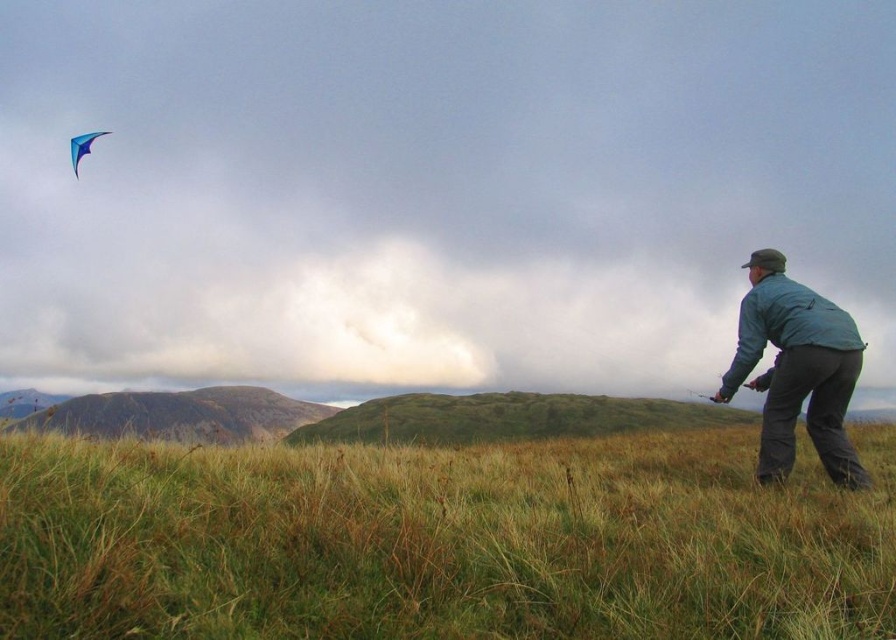
Question: Which is nearer to the green grassy field at lower right?

Choices:
 (A) green matte jacket at right
 (B) blue glossy kite at upper left

Answer: (A)

Question: Does green matte jacket at right come behind blue glossy kite at upper left?

Choices:
 (A) no
 (B) yes

Answer: (A)

Question: Is green grassy field at lower right thinner than blue glossy kite at upper left?

Choices:
 (A) yes
 (B) no

Answer: (A)

Question: Considering the relative positions of green grassy field at lower right and blue glossy kite at upper left in the image provided, where is green grassy field at lower right located with respect to blue glossy kite at upper left?

Choices:
 (A) right
 (B) left

Answer: (A)

Question: Which point is farther to the camera?

Choices:
 (A) blue glossy kite at upper left
 (B) green matte jacket at right

Answer: (A)

Question: Which object is the closest to the green grassy field at lower right?

Choices:
 (A) green matte jacket at right
 (B) blue glossy kite at upper left

Answer: (A)